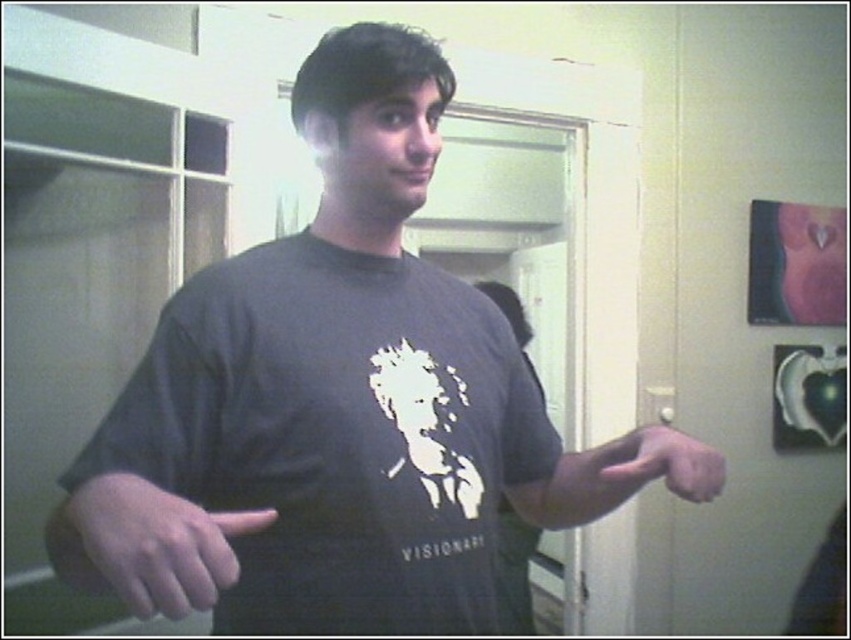
Can you confirm if dark gray t-shirt at center is shorter than matte black hand at lower left?

No, dark gray t-shirt at center is not shorter than matte black hand at lower left.

What are the coordinates of `dark gray t-shirt at center` in the screenshot? It's located at (337, 436).

Who is higher up, dark gray t-shirt at center or matte gray hand at lower right?

dark gray t-shirt at center

Can you confirm if dark gray t-shirt at center is wider than matte gray hand at lower right?

Yes.

Describe the element at coordinates (337, 436) in the screenshot. I see `dark gray t-shirt at center` at that location.

Identify the location of dark gray t-shirt at center. The width and height of the screenshot is (851, 640). (337, 436).

The height and width of the screenshot is (640, 851). Describe the element at coordinates (157, 544) in the screenshot. I see `matte black hand at lower left` at that location.

Between point (133, 552) and point (643, 474), which one is positioned behind?

Point (643, 474)

This screenshot has height=640, width=851. Find the location of `matte black hand at lower left`. matte black hand at lower left is located at coordinates (157, 544).